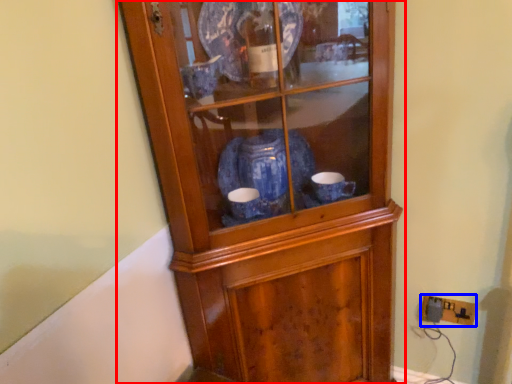
Question: Which object appears closest to the camera in this image, cupboard (highlighted by a red box) or electric outlet (highlighted by a blue box)?

Choices:
 (A) cupboard
 (B) electric outlet

Answer: (A)